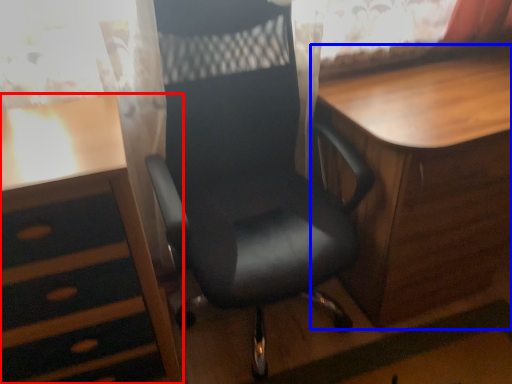
Question: Which of the following is the farthest to the observer, desk (highlighted by a red box) or table (highlighted by a blue box)?

Choices:
 (A) desk
 (B) table

Answer: (B)